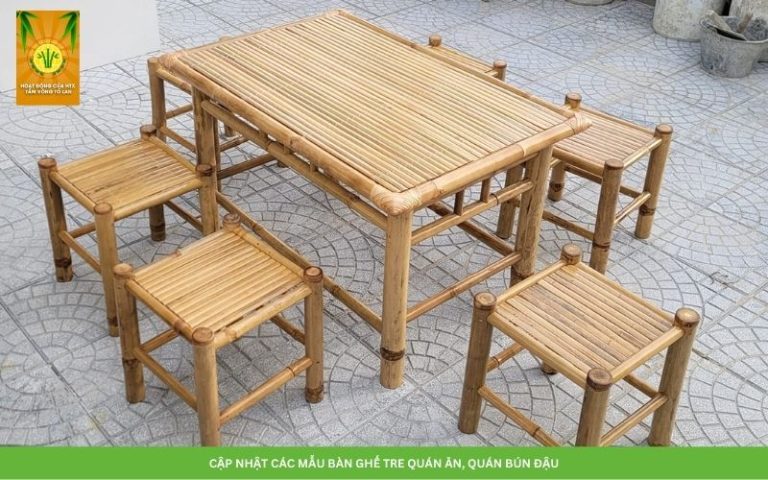
Identify the location of handle. This screenshot has height=480, width=768. (714, 16).